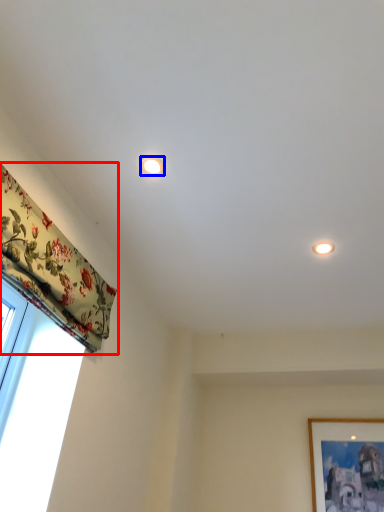
Question: Which object appears farthest to the camera in this image, curtain (highlighted by a red box) or lighting (highlighted by a blue box)?

Choices:
 (A) curtain
 (B) lighting

Answer: (B)